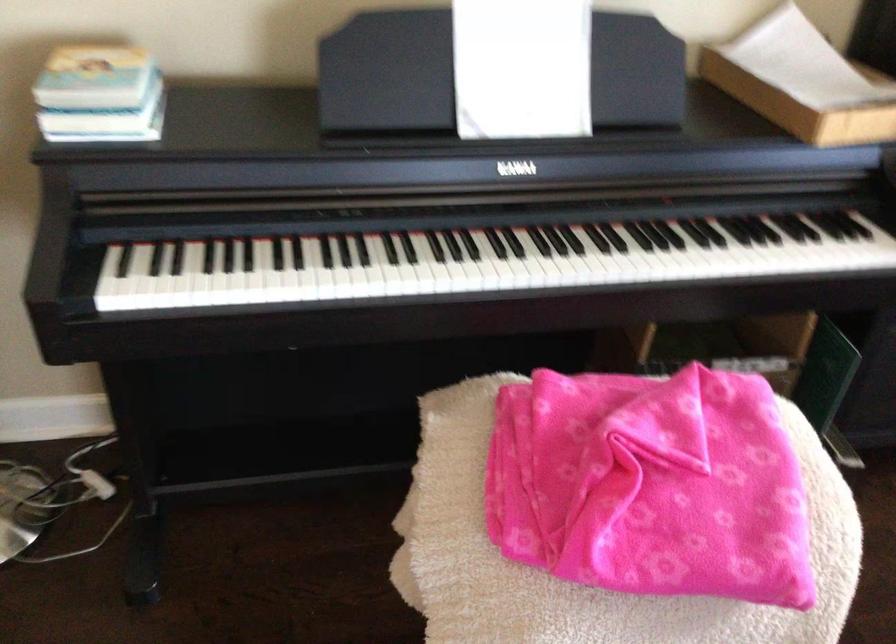
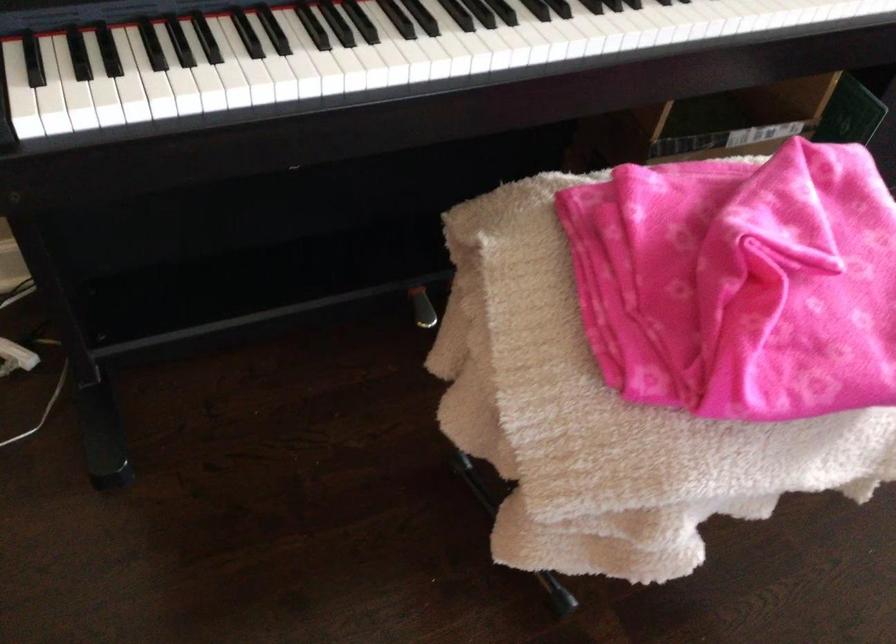
In the second image, find the point that corresponds to pixel 152 275 in the first image.

(87, 80)